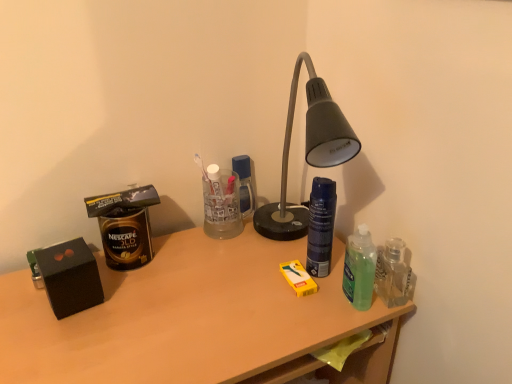
You are a GUI agent. You are given a task and a screenshot of the screen. Output one action in this format:
    pyautogui.click(x=<x>, y=<y>)
    Task: Click on the free point to the left of shiny dark blue spray can at center-right
    
    Given the screenshot: What is the action you would take?
    pyautogui.click(x=240, y=274)